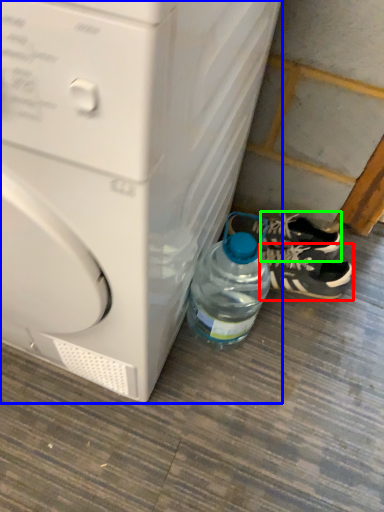
Question: Based on their relative distances, which object is farther from footwear (highlighted by a red box)? Choose from washing machine (highlighted by a blue box) and sneakers (highlighted by a green box).

Choices:
 (A) washing machine
 (B) sneakers

Answer: (A)